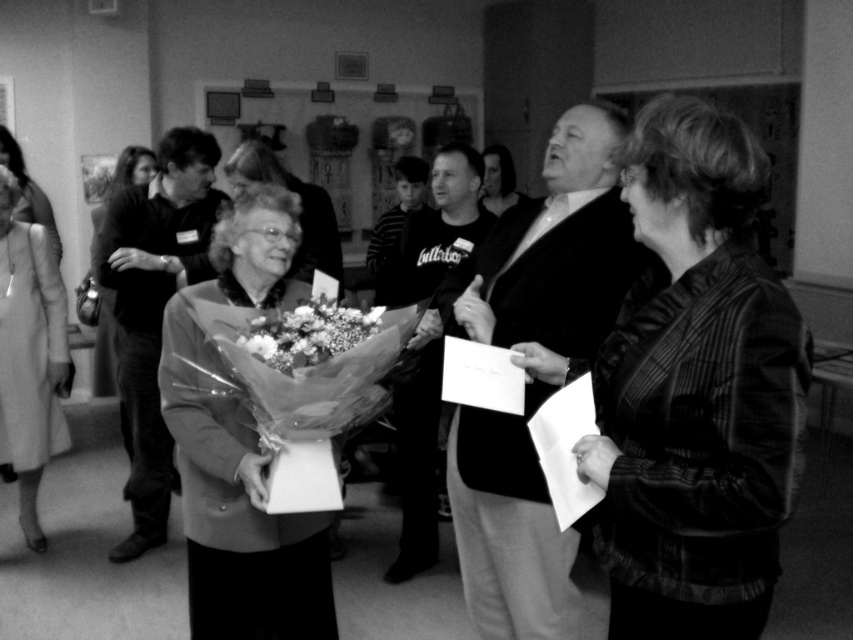
You are a photographer standing 1.5 meters away from the camera. You want to adjust the settings on the camera without moving your feet. Is the striped fabric jacket at center within your reach?

The striped fabric jacket at center and camera are 1.31 meters apart from each other. Since you are already 1.5 meters away from the camera, the distance between you and the striped fabric jacket at center would be 1.5 meters minus 1.31 meters, which is 0.19 meters. Therefore, the striped fabric jacket at center is within your reach.

You are an event planner organizing a photo shoot and need to position a spotlight on the striped fabric jacket at center and the smooth black hair at center. Based on their positions, which object should you place the spotlight higher to illuminate properly?

The smooth black hair at center should be lit with a higher spotlight because it is positioned above the striped fabric jacket at center.

You are an event planner organizing a photo shoot in the described scene. You need to place a small podium between the striped fabric jacket at center and the smooth black shirt at center. Based on their positions, where should the podium be placed relative to these two items?

The podium should be placed below the smooth black shirt at center and above the striped fabric jacket at center since the striped fabric jacket at center is located below the smooth black shirt at center.